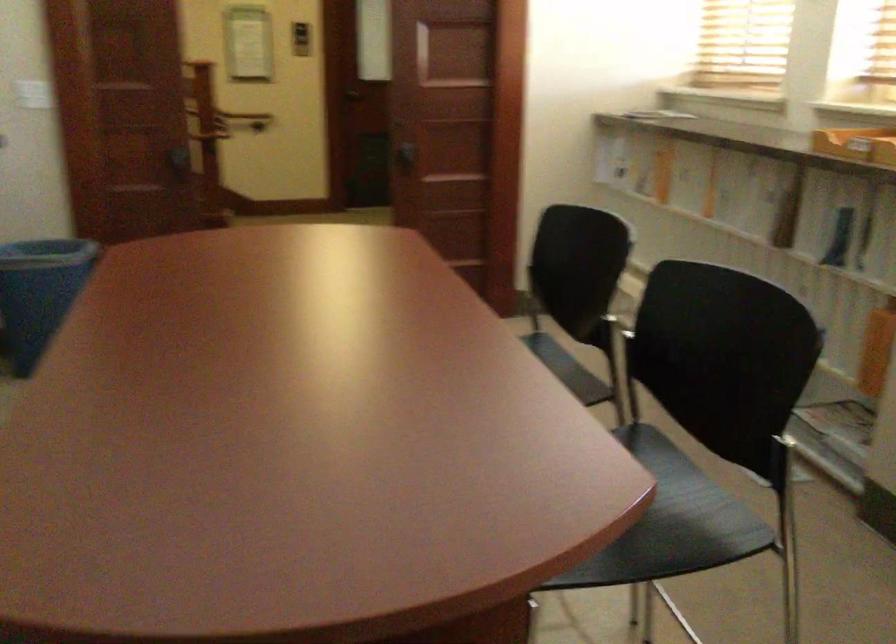
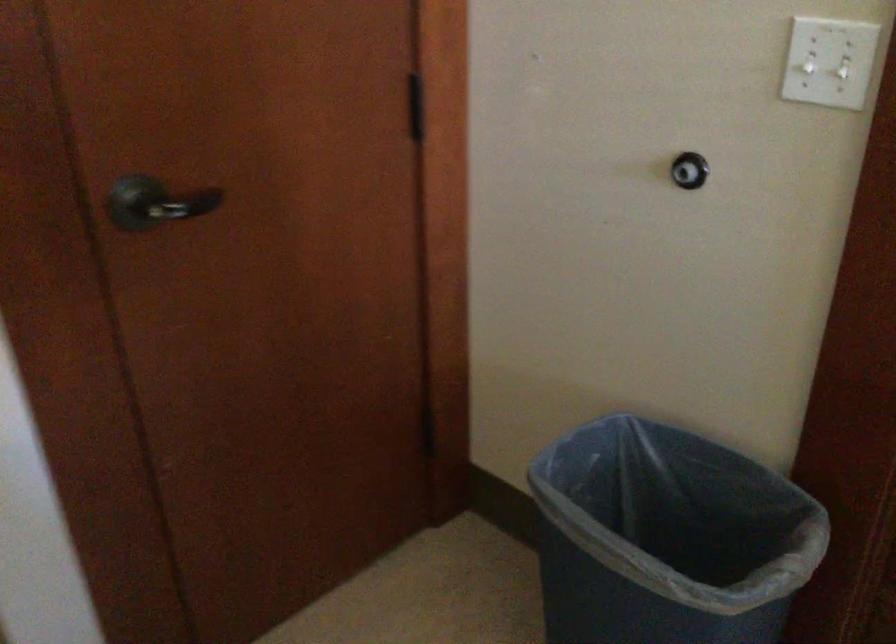
Where in the second image is the point corresponding to (x=73, y=73) from the first image?

(842, 67)